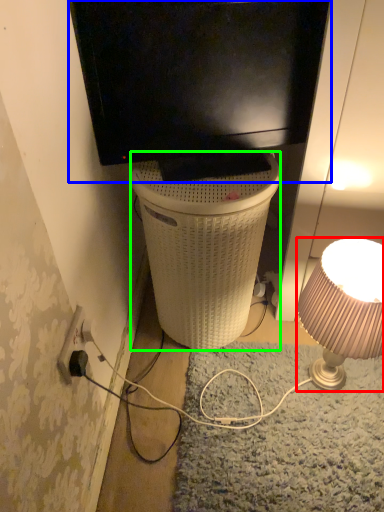
Question: Which object is positioned closest to lamp (highlighted by a red box)? Select from television (highlighted by a blue box) and trash bin/can (highlighted by a green box).

Choices:
 (A) television
 (B) trash bin/can

Answer: (B)